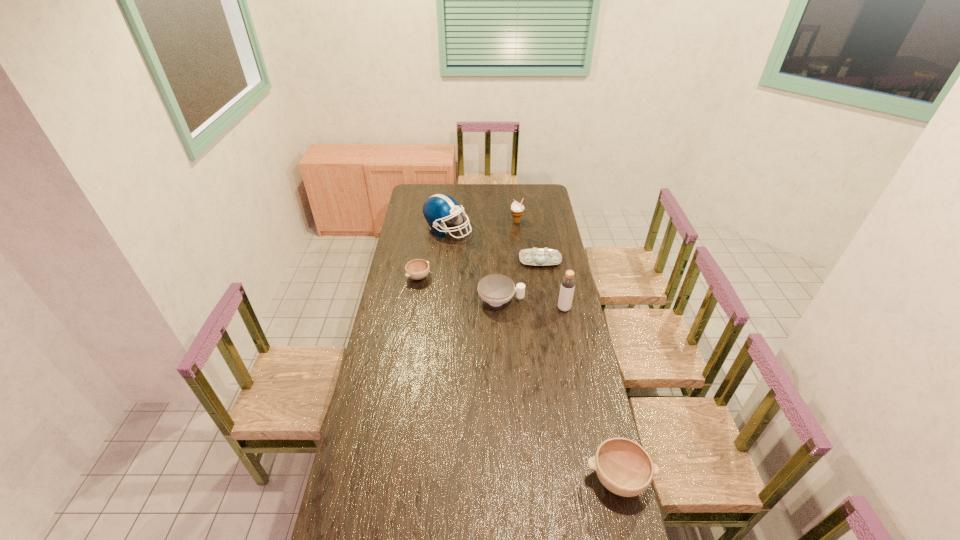
Identify the location of empty location between the football helmet and the fifth shortest object. (482, 226).

Locate an element on the screen. This screenshot has width=960, height=540. vacant space that's between the bottle and the nearer bowl is located at coordinates (591, 393).

Identify the location of vacant space in between the bottle and the third farthest object. (552, 284).

Find the location of `empty space that is in between the farther chinaware and the third tallest object`. empty space that is in between the farther chinaware and the third tallest object is located at coordinates (528, 241).

Where is `vacant space in between the nearer chinaware and the shorter bowl`? vacant space in between the nearer chinaware and the shorter bowl is located at coordinates (460, 289).

Choose which object is the fifth nearest neighbor to the nearer bowl. Please provide its 2D coordinates. Your answer should be formatted as a tuple, i.e. [(x, y)], where the tuple contains the x and y coordinates of a point satisfying the conditions above.

[(438, 208)]

The height and width of the screenshot is (540, 960). Find the location of `the second closest object to the nearer chinaware`. the second closest object to the nearer chinaware is located at coordinates pyautogui.click(x=568, y=281).

Where is `blank area in the image that satisfies the following two spatial constraints: 1. on the back side of the fifth nearest object; 2. on the left side of the shorter bowl`? The height and width of the screenshot is (540, 960). blank area in the image that satisfies the following two spatial constraints: 1. on the back side of the fifth nearest object; 2. on the left side of the shorter bowl is located at coordinates (421, 260).

The width and height of the screenshot is (960, 540). What are the coordinates of `free location that satisfies the following two spatial constraints: 1. on the front side of the fifth shortest object; 2. at the front of the football helmet with the faceguard` in the screenshot? It's located at (517, 230).

Find the location of a particular element. This screenshot has height=540, width=960. vacant space that satisfies the following two spatial constraints: 1. on the side with the handle of the nearer chinaware; 2. on the right side of the taller bowl is located at coordinates (510, 478).